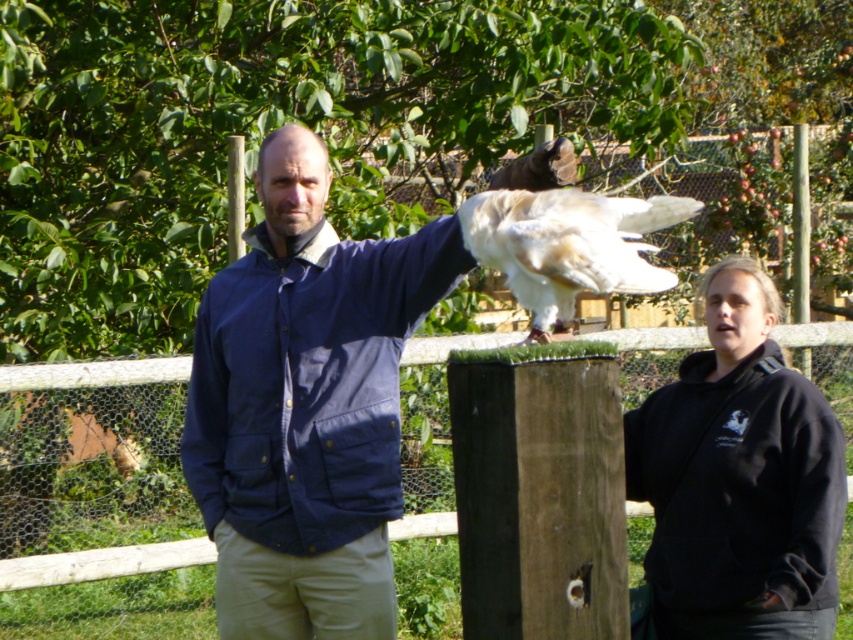
Question: Which object is farther from the camera taking this photo?

Choices:
 (A) black fleece jacket at lower right
 (B) blue cotton jacket at center
 (C) wooden post at center

Answer: (C)

Question: In this image, where is blue cotton jacket at center located relative to black fleece jacket at lower right?

Choices:
 (A) left
 (B) right

Answer: (A)

Question: Is wooden post at center to the right of black fleece jacket at lower right from the viewer's perspective?

Choices:
 (A) yes
 (B) no

Answer: (B)

Question: Which is nearer to the white feathered bird at center?

Choices:
 (A) black fleece jacket at lower right
 (B) blue cotton jacket at center

Answer: (B)

Question: Does blue cotton jacket at center lie in front of black fleece jacket at lower right?

Choices:
 (A) no
 (B) yes

Answer: (B)

Question: Estimate the real-world distances between objects in this image. Which object is closer to the black fleece jacket at lower right?

Choices:
 (A) blue cotton jacket at center
 (B) white feathered bird at center

Answer: (A)